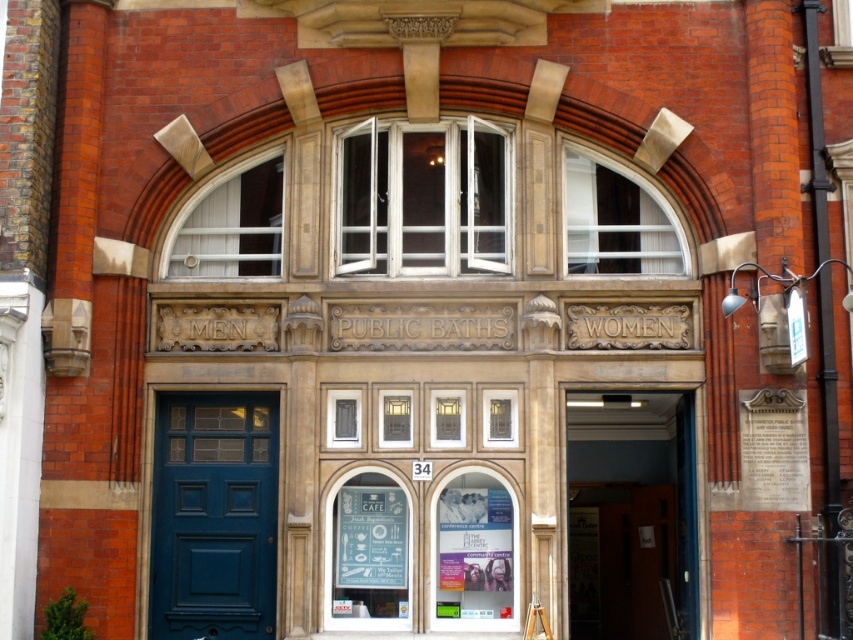
You are standing at the entrance of the historic public baths building. You need to enter through either the wooden door at center or the blue painted wood door at center. However, there is a 50 feet long barrier blocking your path. Can you reach either door without crossing the barrier?

The distance between the wooden door at center and the blue painted wood door at center is 48.51 feet. Since the barrier is 50 feet long, you can reach either door by going around the barrier as the distance between the doors is shorter than the barrier length.

You are a visitor approaching the historic public baths building. You see two doors at the center of the facade. One is labeled as the wooden door at center and the other is the blue painted wood door at center. Which door is wider?

The wooden door at center is wider than the blue painted wood door at center.

You are a visitor arriving at the historic public baths building. You see two doors in front of you labeled as the wooden door at center and the blue painted wood door at center. Which door is bigger?

The wooden door at center is larger in size than the blue painted wood door at center, so the wooden door at center is bigger.